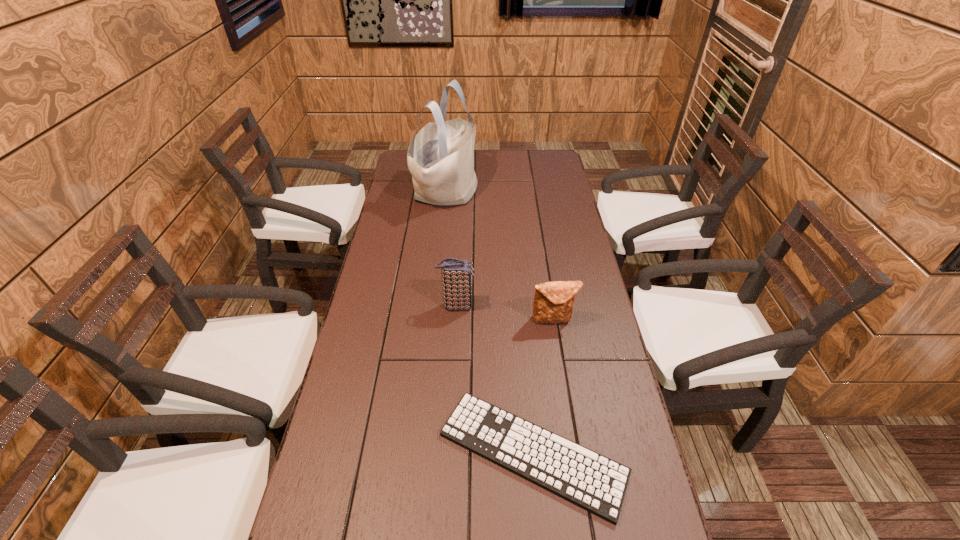
The width and height of the screenshot is (960, 540). Identify the location of free spot at the far left corner of the desktop. (411, 175).

Locate an element on the screen. The height and width of the screenshot is (540, 960). vacant space at the far right corner of the desktop is located at coordinates (529, 175).

The width and height of the screenshot is (960, 540). Identify the location of vacant area between the right clutch bag and the left clutch bag. (505, 313).

You are a GUI agent. You are given a task and a screenshot of the screen. Output one action in this format:
    pyautogui.click(x=<x>, y=<y>)
    Task: Click on the unoccupied area between the nearest object and the farthest object
    This screenshot has width=960, height=540.
    Given the screenshot: What is the action you would take?
    pyautogui.click(x=490, y=321)

Find the location of `vacant region between the left clutch bag and the shorter clutch bag`. vacant region between the left clutch bag and the shorter clutch bag is located at coordinates (505, 313).

What are the coordinates of `free space between the farthest object and the shorter clutch bag` in the screenshot? It's located at (500, 255).

You are a GUI agent. You are given a task and a screenshot of the screen. Output one action in this format:
    pyautogui.click(x=<x>, y=<y>)
    Task: Click on the free spot between the shortest object and the shorter clutch bag
    
    Given the screenshot: What is the action you would take?
    coord(543,386)

Identify the location of free space that is in between the farthest object and the shorter clutch bag. This screenshot has width=960, height=540. [500, 255].

Find the location of `vacant space in between the shopping bag and the right clutch bag`. vacant space in between the shopping bag and the right clutch bag is located at coordinates (500, 255).

What are the coordinates of `free spot between the taller clutch bag and the nearest object` in the screenshot? It's located at click(494, 379).